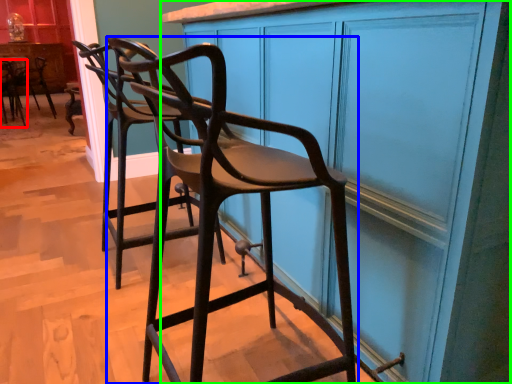
Question: Which object is the farthest from chair (highlighted by a red box)? Choose among these: chair (highlighted by a blue box) or cabinetry (highlighted by a green box).

Choices:
 (A) chair
 (B) cabinetry

Answer: (B)